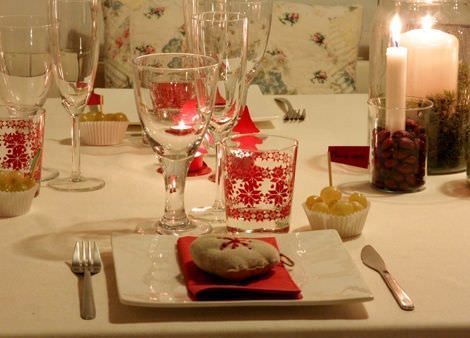
Locate an element on the screen. The image size is (470, 338). utensils and plates is located at coordinates (375, 259), (86, 269), (291, 114), (307, 259), (257, 111).